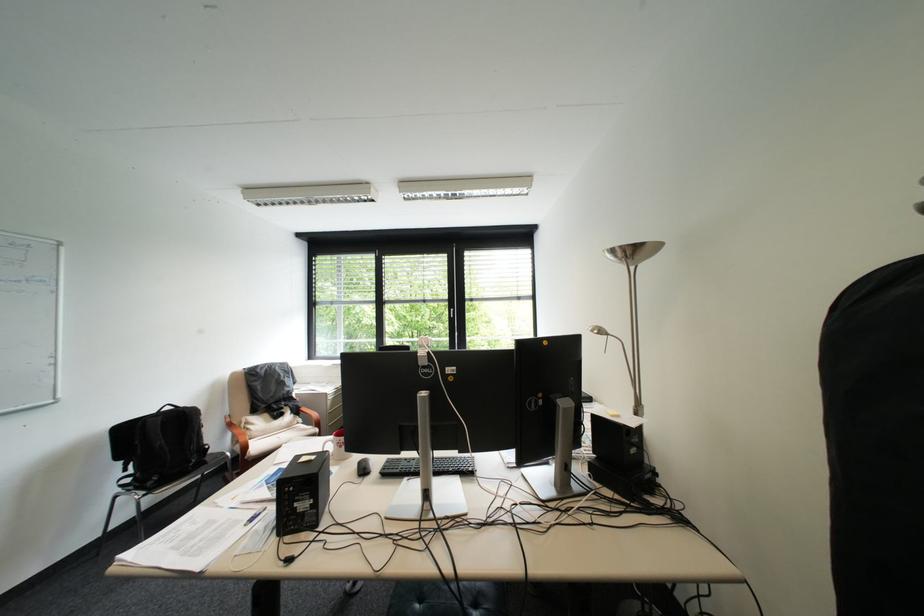
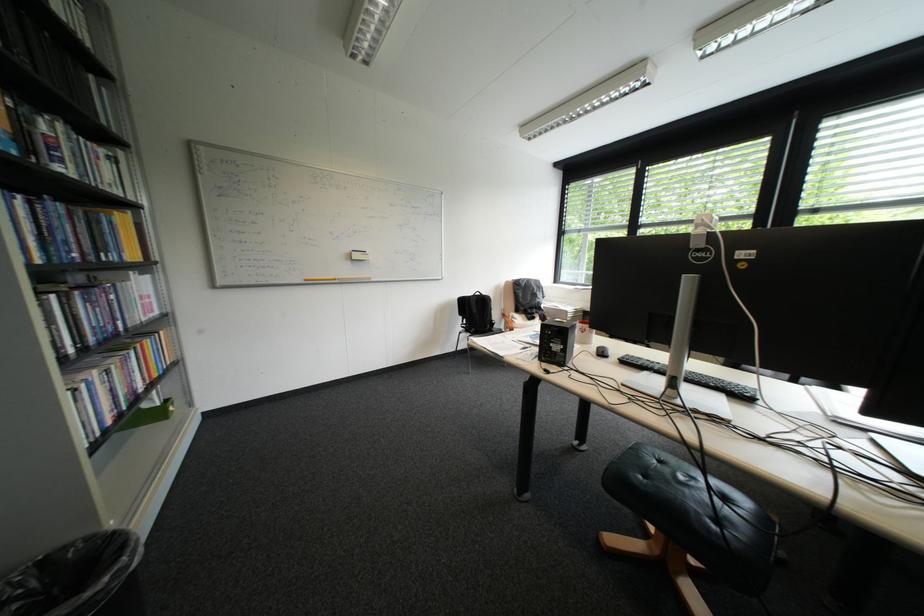
Question: The images are taken continuously from a first-person perspective. In which direction is your viewpoint rotating?

Choices:
 (A) Left
 (B) Right
 (C) Up
 (D) Down

Answer: (A)